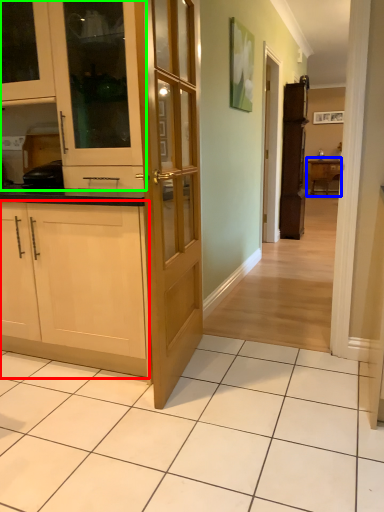
Question: Which is farther away from cabinetry (highlighted by a red box)? table (highlighted by a blue box) or cabinetry (highlighted by a green box)?

Choices:
 (A) table
 (B) cabinetry

Answer: (A)